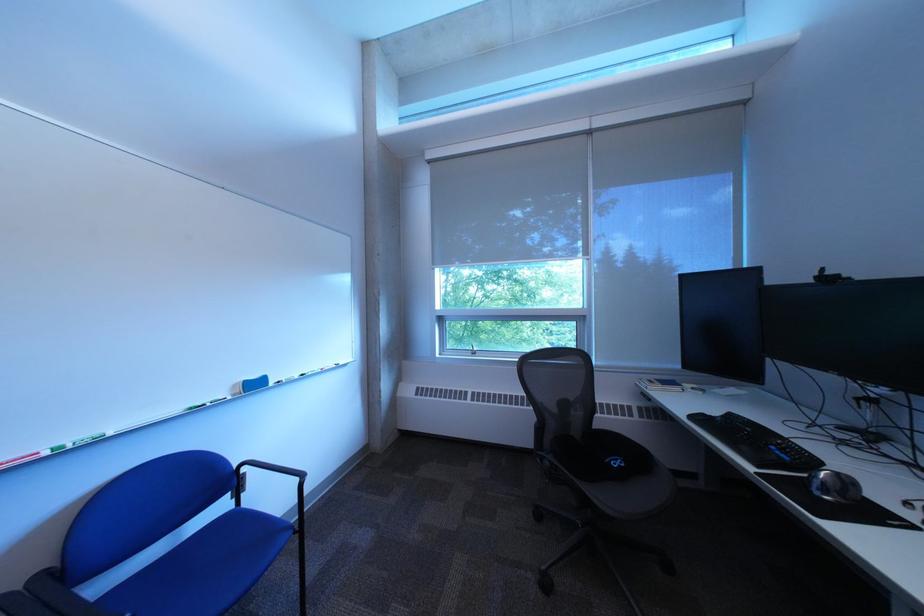
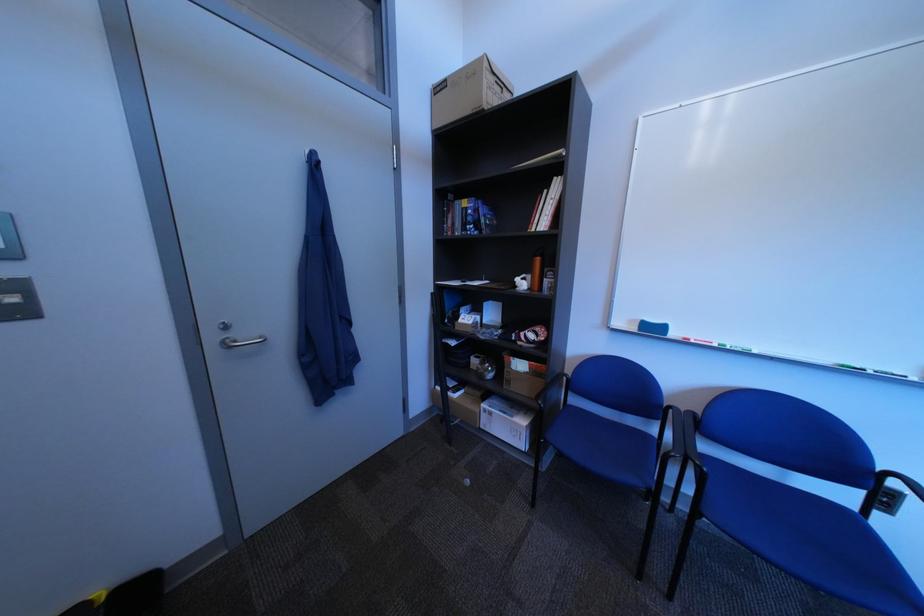
Where in the second image is the point corresponding to pixel 62 455 from the first image?

(732, 347)